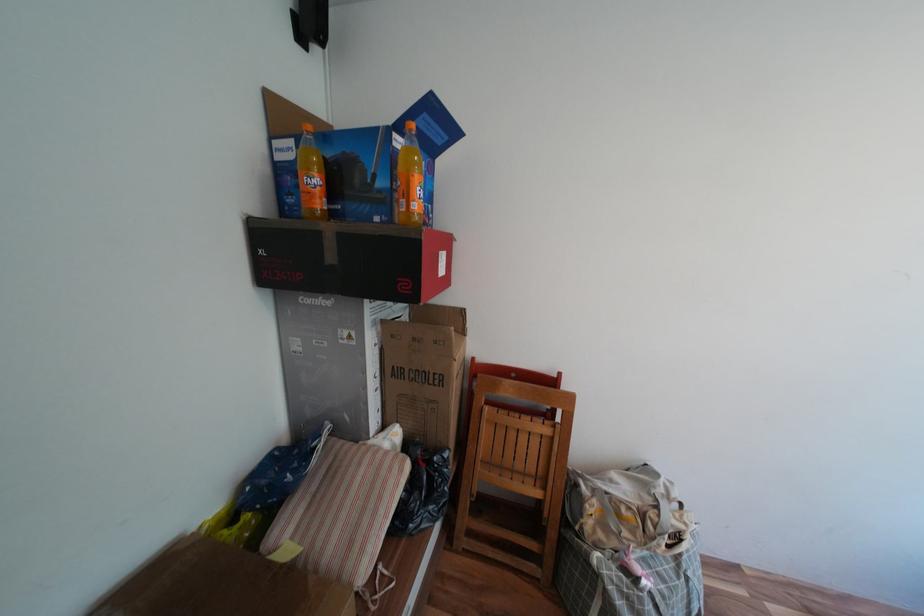
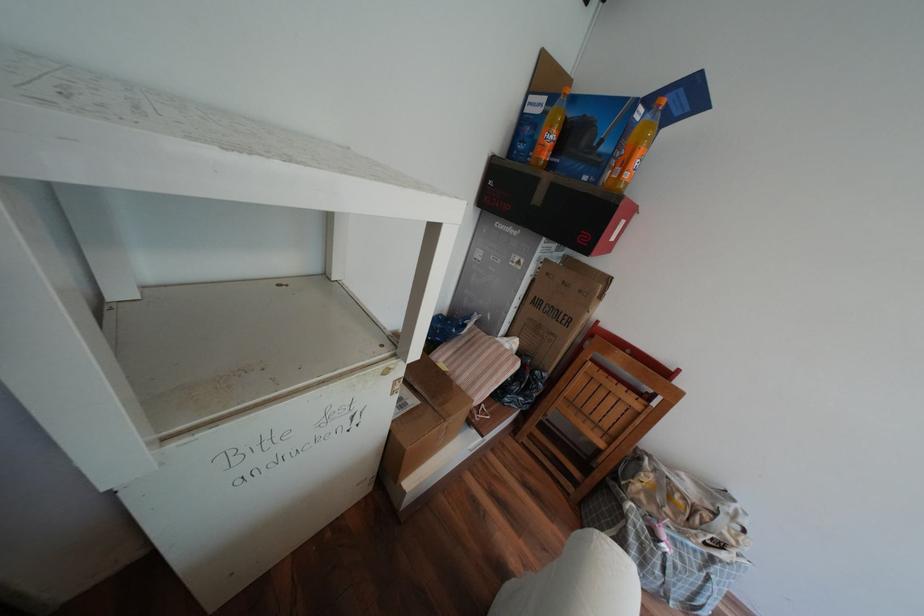
In the second image, find the point that corresponds to point (317, 301) in the first image.

(511, 225)